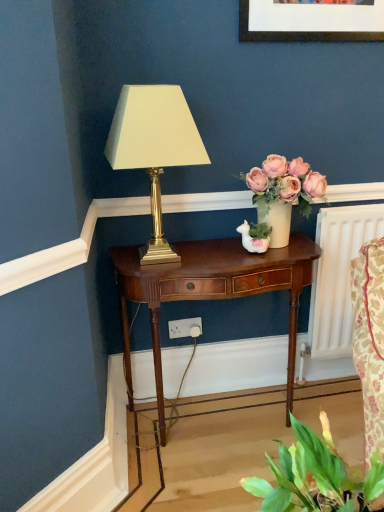
What are the coordinates of `blank area beneath gold metallic lamp at center (from a real-world perspective)` in the screenshot? It's located at (166, 262).